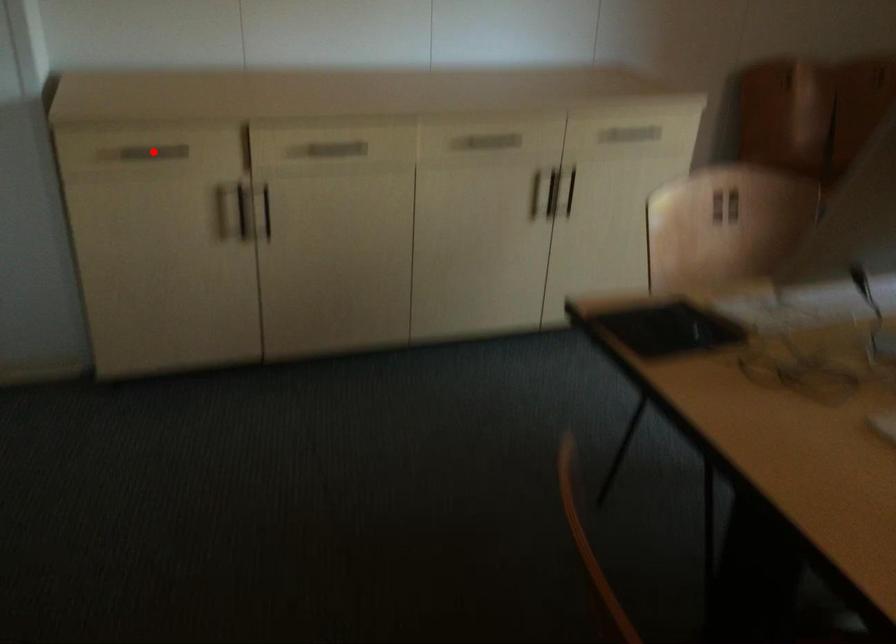
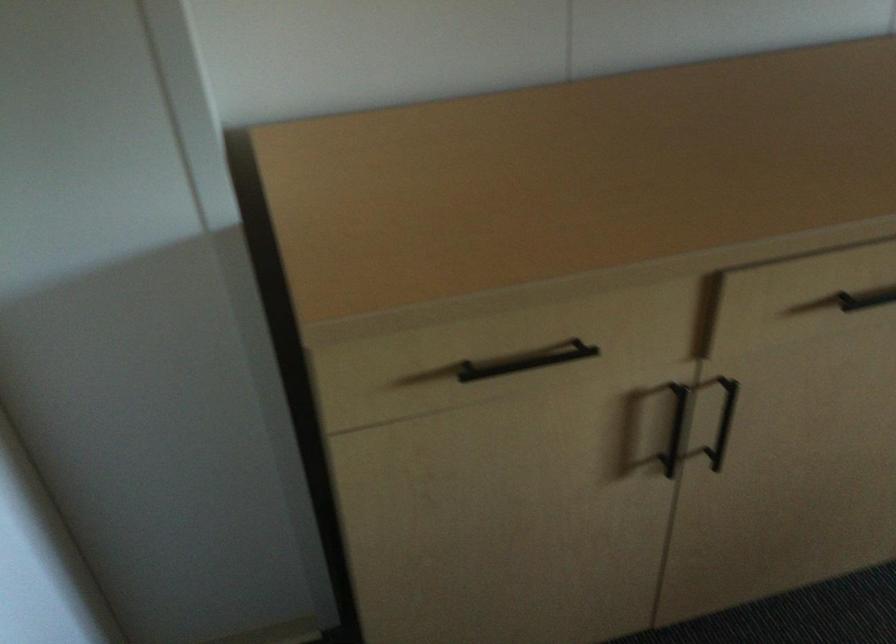
In the second image, find the point that corresponds to the highlighted location in the first image.

(526, 361)